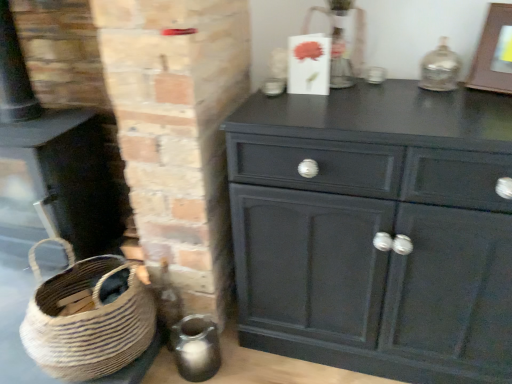
You are a GUI agent. You are given a task and a screenshot of the screen. Output one action in this format:
    pyautogui.click(x=<x>, y=<y>)
    Task: Click on the natural woven basket at lower left
    Image resolution: width=512 pixels, height=384 pixels.
    Given the screenshot: What is the action you would take?
    pyautogui.click(x=88, y=317)

This screenshot has width=512, height=384. Find the location of `wooden picture frame at upper right`. wooden picture frame at upper right is located at coordinates (492, 54).

Is wooden picture frame at upper right not near matte black fireplace at lower left?

Yes, wooden picture frame at upper right and matte black fireplace at lower left are quite far apart.

Considering the sizes of wooden picture frame at upper right and matte black fireplace at lower left in the image, is wooden picture frame at upper right wider or thinner than matte black fireplace at lower left?

In the image, wooden picture frame at upper right appears to be more narrow than matte black fireplace at lower left.

Is wooden picture frame at upper right facing away from matte black fireplace at lower left?

No.

Is wooden picture frame at upper right far from matte black cabinet at center?

wooden picture frame at upper right is actually quite close to matte black cabinet at center.

Who is taller, wooden picture frame at upper right or matte black cabinet at center?

matte black cabinet at center is taller.

From a real-world perspective, which is physically below, wooden picture frame at upper right or matte black cabinet at center?

matte black cabinet at center.

From the image's perspective, is wooden picture frame at upper right positioned above or below matte black cabinet at center?

wooden picture frame at upper right is above matte black cabinet at center.

Would you say matte black fireplace at lower left is inside or outside matte black cabinet at center?

matte black fireplace at lower left is located beyond the bounds of matte black cabinet at center.

In the scene shown: Which is behind, matte black fireplace at lower left or matte black cabinet at center?

matte black fireplace at lower left is further away from the camera.

Considering the sizes of objects matte black fireplace at lower left and matte black cabinet at center in the image provided, who is shorter, matte black fireplace at lower left or matte black cabinet at center?

With less height is matte black cabinet at center.

Is natural woven basket at lower left placed right next to wooden picture frame at upper right?

They are not placed beside each other.

Which object is positioned more to the right, natural woven basket at lower left or wooden picture frame at upper right?

Positioned to the right is wooden picture frame at upper right.

From a real-world perspective, who is located higher, natural woven basket at lower left or wooden picture frame at upper right?

wooden picture frame at upper right.

You are a GUI agent. You are given a task and a screenshot of the screen. Output one action in this format:
    pyautogui.click(x=<x>, y=<y>)
    Task: Click on the picture frame above the natural woven basket at lower left (from the image's perspective)
    
    Given the screenshot: What is the action you would take?
    pyautogui.click(x=492, y=54)

Is the position of wooden picture frame at upper right more distant than that of natural woven basket at lower left?

No, wooden picture frame at upper right is closer to the camera.

Does wooden picture frame at upper right have a smaller size compared to natural woven basket at lower left?

Yes.

Is wooden picture frame at upper right to the left or to the right of natural woven basket at lower left in the image?

wooden picture frame at upper right is to the right of natural woven basket at lower left.

Is wooden picture frame at upper right aimed at natural woven basket at lower left?

No, wooden picture frame at upper right is not turned towards natural woven basket at lower left.

Looking at this image, can you confirm if natural woven basket at lower left is positioned to the left of matte black cabinet at center?

Correct, you'll find natural woven basket at lower left to the left of matte black cabinet at center.

From a real-world perspective, who is located higher, natural woven basket at lower left or matte black cabinet at center?

matte black cabinet at center.

Considering the positions of point (50, 290) and point (318, 190), is point (50, 290) closer or farther from the camera than point (318, 190)?

Point (50, 290) is positioned farther from the camera compared to point (318, 190).

From the image's perspective, which is above, natural woven basket at lower left or matte black fireplace at lower left?

matte black fireplace at lower left is shown above in the image.

From a real-world perspective, which is physically below, natural woven basket at lower left or matte black fireplace at lower left?

From a 3D spatial view, natural woven basket at lower left is below.

Looking at this image, between natural woven basket at lower left and matte black fireplace at lower left, which one is positioned behind?

matte black fireplace at lower left is behind.

Find the location of a particular element. fireplace below the wooden picture frame at upper right (from the image's perspective) is located at coordinates (52, 164).

At what (x,y) coordinates should I click in order to perform the action: click on the chest of drawers in front of the wooden picture frame at upper right. Please return your answer as a coordinate pair (x, y). Image resolution: width=512 pixels, height=384 pixels. Looking at the image, I should click on (376, 230).

Based on their spatial positions, is matte black cabinet at center or matte black fireplace at lower left further from natural woven basket at lower left?

The object further to natural woven basket at lower left is matte black cabinet at center.

When comparing their distances from wooden picture frame at upper right, does matte black cabinet at center or matte black fireplace at lower left seem further?

matte black fireplace at lower left lies further to wooden picture frame at upper right than the other object.

From the image, which object appears to be nearer to matte black fireplace at lower left, natural woven basket at lower left or matte black cabinet at center?

The object closer to matte black fireplace at lower left is natural woven basket at lower left.

Looking at the image, which one is located further to natural woven basket at lower left, matte black cabinet at center or wooden picture frame at upper right?

wooden picture frame at upper right.

Considering their positions, is matte black cabinet at center positioned further to matte black fireplace at lower left than wooden picture frame at upper right?

wooden picture frame at upper right is positioned further to the anchor matte black fireplace at lower left.

Estimate the real-world distances between objects in this image. Which object is closer to natural woven basket at lower left, wooden picture frame at upper right or matte black fireplace at lower left?

matte black fireplace at lower left is closer to natural woven basket at lower left.

Considering their positions, is natural woven basket at lower left positioned closer to matte black cabinet at center than wooden picture frame at upper right?

wooden picture frame at upper right.

Based on their spatial positions, is wooden picture frame at upper right or matte black fireplace at lower left closer to matte black cabinet at center?

Based on the image, wooden picture frame at upper right appears to be nearer to matte black cabinet at center.

I want to click on basket located between matte black fireplace at lower left and wooden picture frame at upper right in the left-right direction, so click(88, 317).

Where is `chest of drawers between matte black fireplace at lower left and wooden picture frame at upper right in the horizontal direction`? Image resolution: width=512 pixels, height=384 pixels. chest of drawers between matte black fireplace at lower left and wooden picture frame at upper right in the horizontal direction is located at coordinates (376, 230).

Locate an element on the screen. This screenshot has width=512, height=384. the chest of drawers located between natural woven basket at lower left and wooden picture frame at upper right in the left-right direction is located at coordinates pos(376,230).

The image size is (512, 384). What are the coordinates of `basket between matte black fireplace at lower left and matte black cabinet at center from left to right` in the screenshot? It's located at (88, 317).